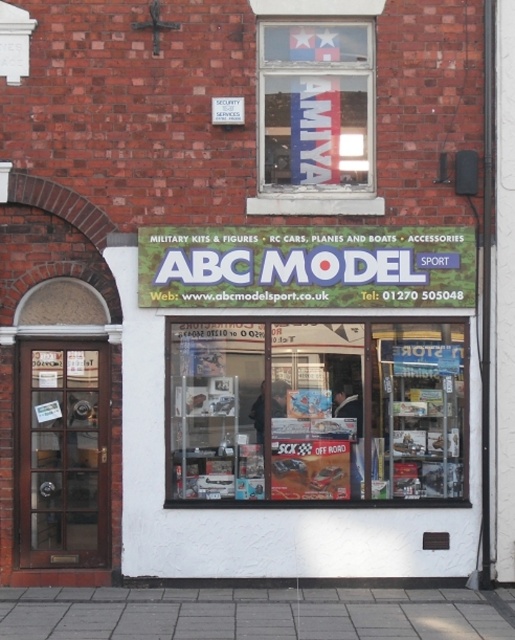
Does matte plastic model kit at center appear over gray concrete pavement at lower center?

Correct, matte plastic model kit at center is located above gray concrete pavement at lower center.

Who is more distant from viewer, (400, 378) or (29, 611)?

Point (400, 378)

The height and width of the screenshot is (640, 515). I want to click on matte plastic model kit at center, so click(317, 412).

Does matte plastic model kit at center have a greater height compared to white plastic sign at center?

Indeed, matte plastic model kit at center has a greater height compared to white plastic sign at center.

Does matte plastic model kit at center have a lesser width compared to white plastic sign at center?

Indeed, matte plastic model kit at center has a lesser width compared to white plastic sign at center.

Locate an element on the screen. The width and height of the screenshot is (515, 640). matte plastic model kit at center is located at coordinates (317, 412).

Which is below, white plastic sign at center or gray concrete pavement at lower center?

gray concrete pavement at lower center is lower down.

Is white plastic sign at center thinner than gray concrete pavement at lower center?

Indeed, white plastic sign at center has a lesser width compared to gray concrete pavement at lower center.

What do you see at coordinates (306, 266) in the screenshot? This screenshot has width=515, height=640. I see `white plastic sign at center` at bounding box center [306, 266].

This screenshot has width=515, height=640. I want to click on white plastic sign at center, so click(306, 266).